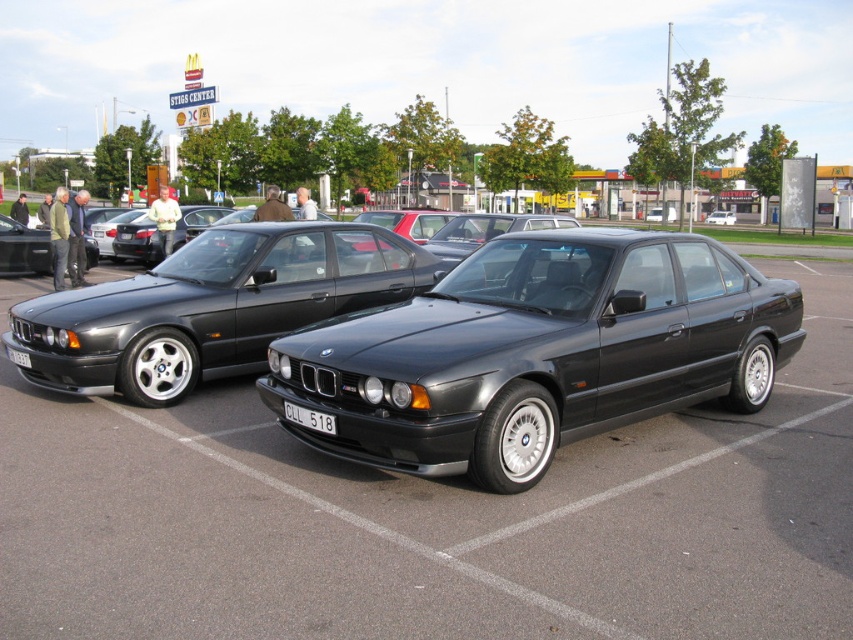
You are a photographer at the car exhibition trying to capture a closeup of the black plastic license plate at center. Based on its position, which car should you focus on, the dark gray BMW E34 on the left or the other BMW E34 on the right?

The black plastic license plate at center is located at point (309, 419), which places it on the dark gray BMW E34 on the left. Therefore, you should focus on the dark gray BMW E34 on the left to capture the license plate.

You are a photographer at the car exhibition. You need to capture a photo that includes both the matte black sedan at center and the shiny black sedan at center. Given that your camera frame can only accommodate one of the sedans fully, which sedan should you position closer to the camera to ensure both fit within the frame?

The matte black sedan at center is bigger than the shiny black sedan at center. To fit both within the frame, position the shiny black sedan at center closer to the camera since it is smaller, allowing more space for the larger matte black sedan at center.